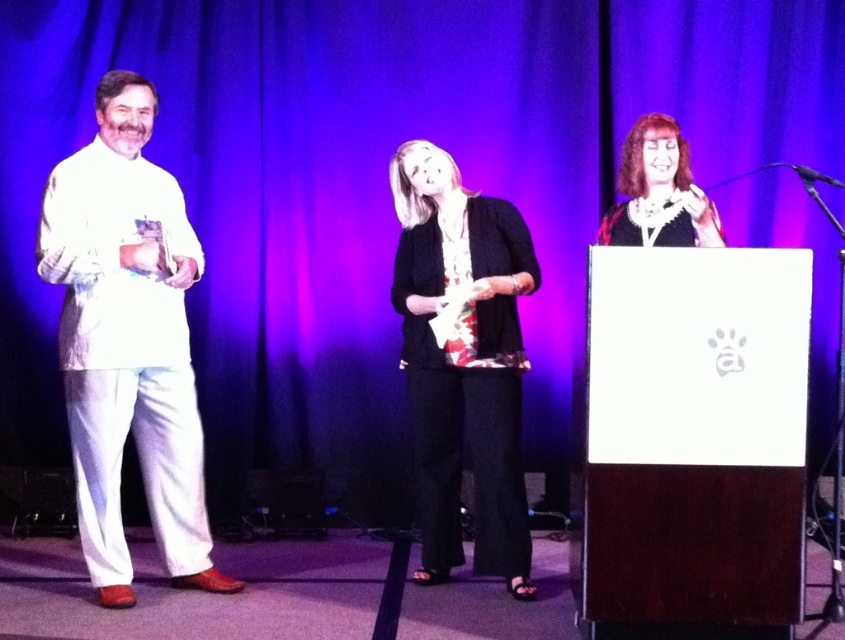
Is the position of white satin suit at left less distant than that of matte black dress at center?

No, it is behind matte black dress at center.

Does white satin suit at left have a greater height compared to matte black dress at center?

Yes.

Which is behind, point (170, 218) or point (633, 212)?

Positioned behind is point (170, 218).

Locate an element on the screen. white satin suit at left is located at coordinates click(x=127, y=340).

Which is below, white satin suit at left or black textured pants at center?

black textured pants at center is below.

The image size is (845, 640). Describe the element at coordinates (127, 340) in the screenshot. I see `white satin suit at left` at that location.

This screenshot has width=845, height=640. In order to click on white satin suit at left in this screenshot , I will do `click(127, 340)`.

Which is behind, point (470, 204) or point (677, 232)?

Positioned behind is point (470, 204).

You are a GUI agent. You are given a task and a screenshot of the screen. Output one action in this format:
    pyautogui.click(x=<x>, y=<y>)
    Task: Click on the black textured pants at center
    Image resolution: width=845 pixels, height=640 pixels.
    Given the screenshot: What is the action you would take?
    pyautogui.click(x=462, y=360)